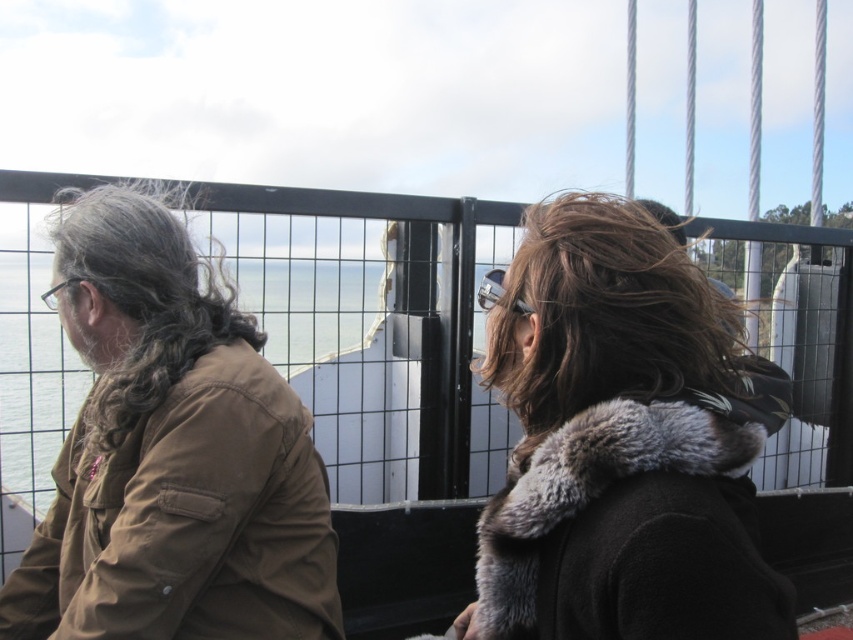
You are standing on the deck of a ferry and want to take a photo of the dark brown fur coat at center without including the black metal fence at upper center in the frame. Is this possible given their positions?

The black metal fence at upper center is located above the dark brown fur coat at center, so it might block the view. To avoid including the fence, you would need to lower your camera angle or move closer to the coat to frame it without the fence in the shot.

You are a photographer trying to capture a candid shot of the two people on the ferry deck. To ensure both subjects are in focus, you need to know which object is taller. Which one is taller between the dark brown fur coat at center and the brown fuzzy hair at center?

The dark brown fur coat at center is taller than the brown fuzzy hair at center according to the description.